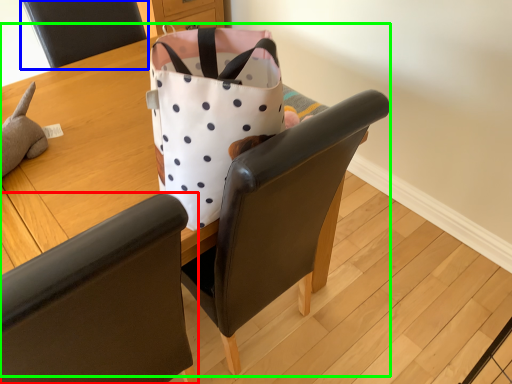
Question: Estimate the real-world distances between objects in this image. Which object is farther from chair (highlighted by a red box), chair (highlighted by a blue box) or table (highlighted by a green box)?

Choices:
 (A) chair
 (B) table

Answer: (A)